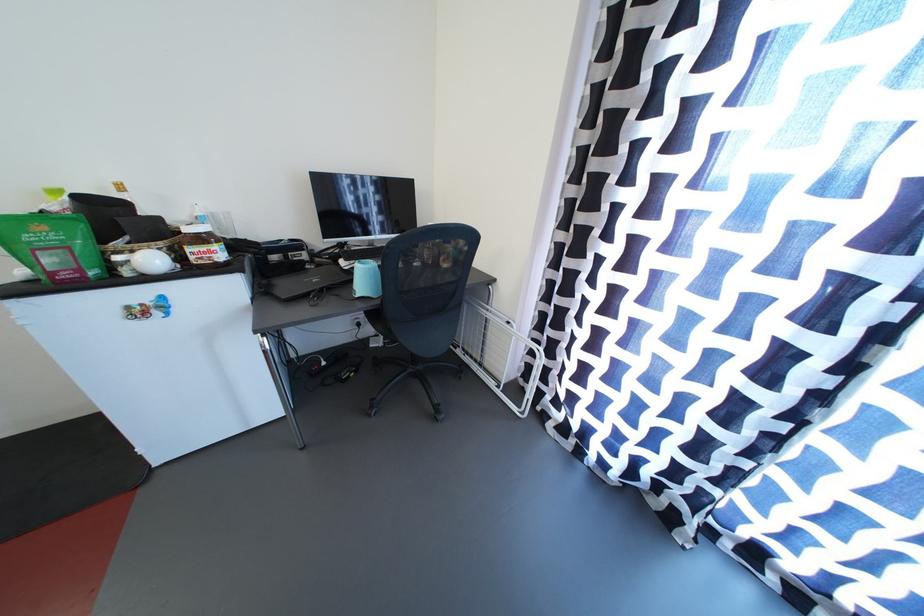
The width and height of the screenshot is (924, 616). I want to click on Nutella jar lid, so click(x=191, y=229).